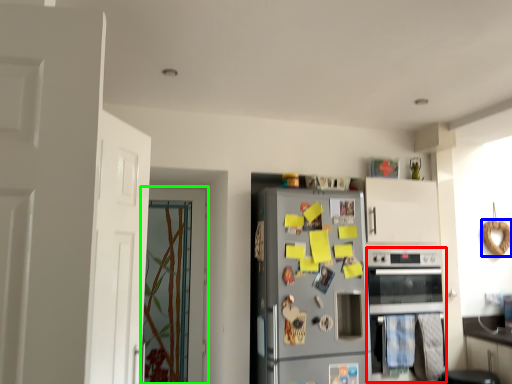
Question: Which object is positioned farthest from oven (highlighted by a red box)? Select from bagel (highlighted by a blue box) and door (highlighted by a green box).

Choices:
 (A) bagel
 (B) door

Answer: (B)